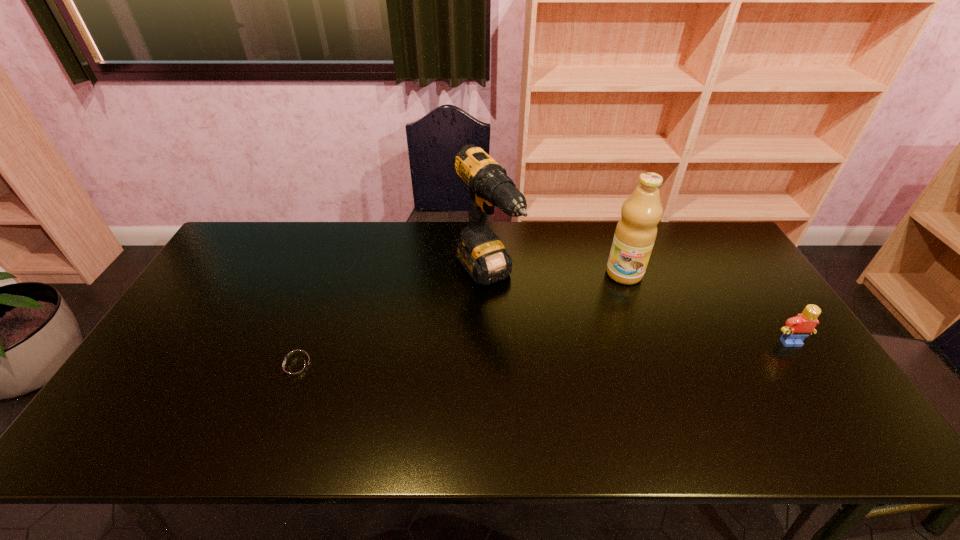
Locate an element on the screen. The height and width of the screenshot is (540, 960). vacant area situated 0.390m at the tip of the third object from right to left is located at coordinates (591, 404).

Locate an element on the screen. Image resolution: width=960 pixels, height=540 pixels. free space located at the tip of the third object from right to left is located at coordinates (570, 380).

Where is `free space located at the tip of the third object from right to left`? Image resolution: width=960 pixels, height=540 pixels. free space located at the tip of the third object from right to left is located at coordinates (540, 346).

The height and width of the screenshot is (540, 960). I want to click on vacant region located on the label of the olive oil, so click(x=609, y=359).

Find the location of a particular element. Image resolution: width=960 pixels, height=540 pixels. vacant space positioned on the label of the olive oil is located at coordinates (604, 389).

This screenshot has height=540, width=960. In order to click on free space located on the label of the olive oil in this screenshot , I will do `click(610, 356)`.

Locate an element on the screen. The width and height of the screenshot is (960, 540). drill that is at the far edge is located at coordinates (482, 254).

Where is `olive oil that is at the far edge`? olive oil that is at the far edge is located at coordinates (636, 231).

At what (x,y) coordinates should I click in order to perform the action: click on object that is positioned at the near edge. Please return your answer as a coordinate pair (x, y). Image resolution: width=960 pixels, height=540 pixels. Looking at the image, I should click on (295, 368).

At what (x,y) coordinates should I click in order to perform the action: click on object that is at the right edge. Please return your answer as a coordinate pair (x, y). Image resolution: width=960 pixels, height=540 pixels. Looking at the image, I should click on (795, 330).